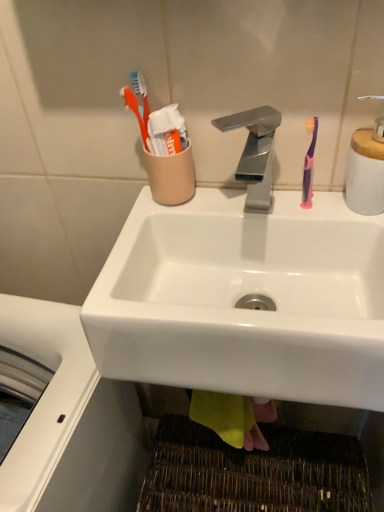
Where is `vacant region to the left of pink plastic toothbrush at right`? Image resolution: width=384 pixels, height=512 pixels. vacant region to the left of pink plastic toothbrush at right is located at coordinates (221, 212).